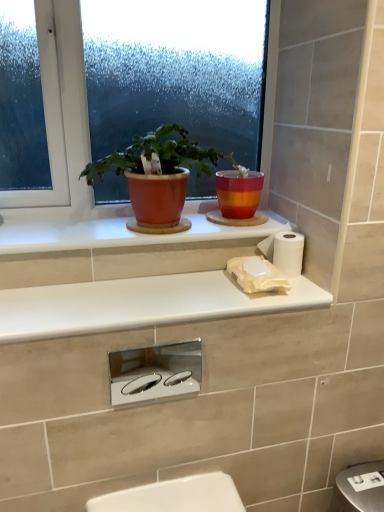
This screenshot has width=384, height=512. I want to click on space that is in front of white matte toilet paper at right, so click(282, 298).